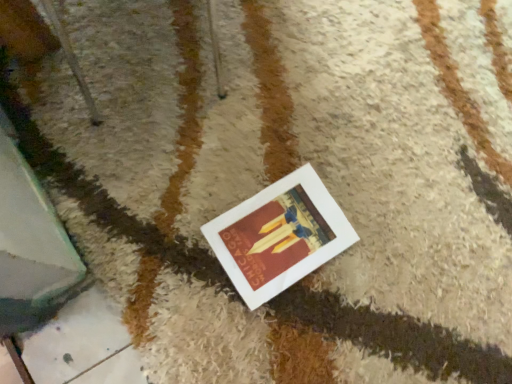
Describe the element at coordinates (279, 236) in the screenshot. I see `white matte picture frame at center` at that location.

Where is `white matte picture frame at center`? This screenshot has height=384, width=512. white matte picture frame at center is located at coordinates (279, 236).

The image size is (512, 384). Identify the location of white matte picture frame at center. (279, 236).